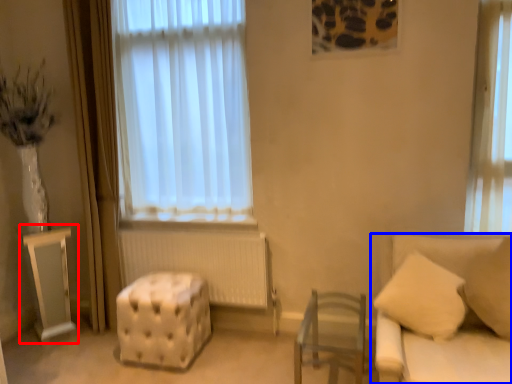
Question: Among these objects, which one is farthest to the camera, table (highlighted by a red box) or studio couch (highlighted by a blue box)?

Choices:
 (A) table
 (B) studio couch

Answer: (A)